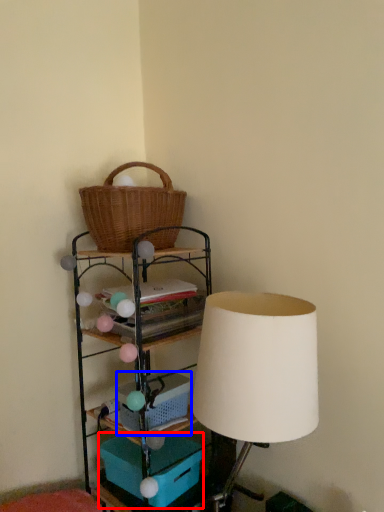
Question: Which point is further to the camera, storage box (highlighted by a red box) or basket (highlighted by a blue box)?

Choices:
 (A) storage box
 (B) basket

Answer: (B)